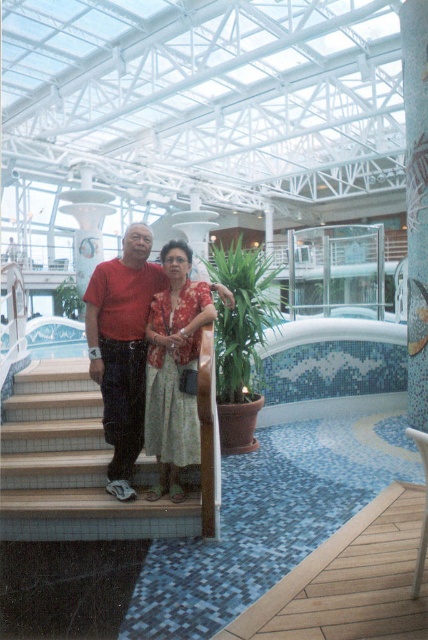
Question: In this image, where is wooden stairs at center located relative to green leafy plant at center?

Choices:
 (A) above
 (B) below

Answer: (B)

Question: Estimate the real-world distances between objects in this image. Which object is closer to the green leafy plant at upper center?

Choices:
 (A) white glossy pillar at upper center
 (B) matte red shirt at center
 (C) blue mosaic tile pool at center

Answer: (C)

Question: Which point appears farthest from the camera in this image?

Choices:
 (A) (110, 333)
 (B) (249, 314)

Answer: (B)

Question: Which object appears closest to the camera in this image?

Choices:
 (A) green leafy plant at center
 (B) white glossy pillar at upper center

Answer: (A)

Question: Is blue mosaic tile pool at center thinner than matte red shirt at center?

Choices:
 (A) no
 (B) yes

Answer: (A)

Question: Does matte red shirt at center lie in front of white glossy pillar at upper center?

Choices:
 (A) yes
 (B) no

Answer: (A)